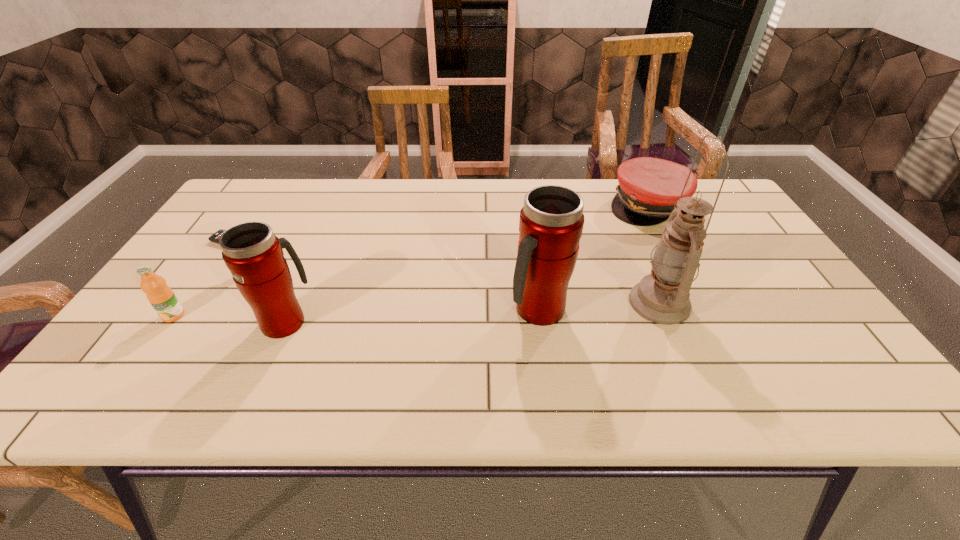
At what (x,y) coordinates should I click in order to perform the action: click on vacant space positioned 0.090m on the side with the handle of the fourth shortest object. Please return your answer as a coordinate pair (x, y). The image size is (960, 540). Looking at the image, I should click on (305, 277).

Find the location of `vacant space positioned 0.250m on the side with the handle of the fourth shortest object`. vacant space positioned 0.250m on the side with the handle of the fourth shortest object is located at coordinates (322, 239).

Find the location of a particular element. The height and width of the screenshot is (540, 960). free location located 0.110m on the side with the handle of the fourth shortest object is located at coordinates (307, 272).

Identify the location of vacant region located 0.340m at the front of the fifth tallest object where the visor is located. This screenshot has height=540, width=960. (702, 312).

The image size is (960, 540). Identify the location of vacant space situated on the back of the oil lamp. coord(637,251).

Where is `vacant space situated on the front of the remote control`? vacant space situated on the front of the remote control is located at coordinates (186, 334).

The width and height of the screenshot is (960, 540). What are the coordinates of `vacant point located on the label of the orange juice` in the screenshot? It's located at (156, 340).

Where is `object located at the far edge`? The image size is (960, 540). object located at the far edge is located at coordinates (649, 188).

At what (x,y) coordinates should I click in order to perform the action: click on remote control at the left edge. Please return your answer as a coordinate pair (x, y). The image size is (960, 540). Looking at the image, I should click on (x=215, y=237).

The height and width of the screenshot is (540, 960). In order to click on orange juice that is at the left edge in this screenshot , I will do `click(161, 297)`.